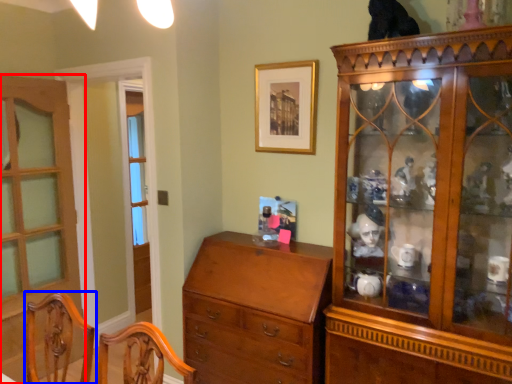
Question: Which of the following is the farthest to the observer, door (highlighted by a red box) or chair (highlighted by a blue box)?

Choices:
 (A) door
 (B) chair

Answer: (A)